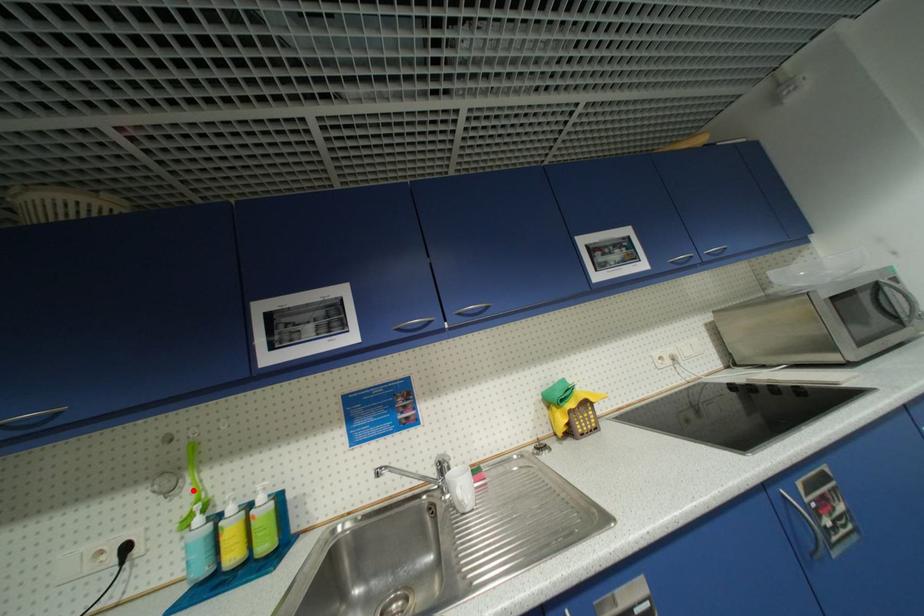
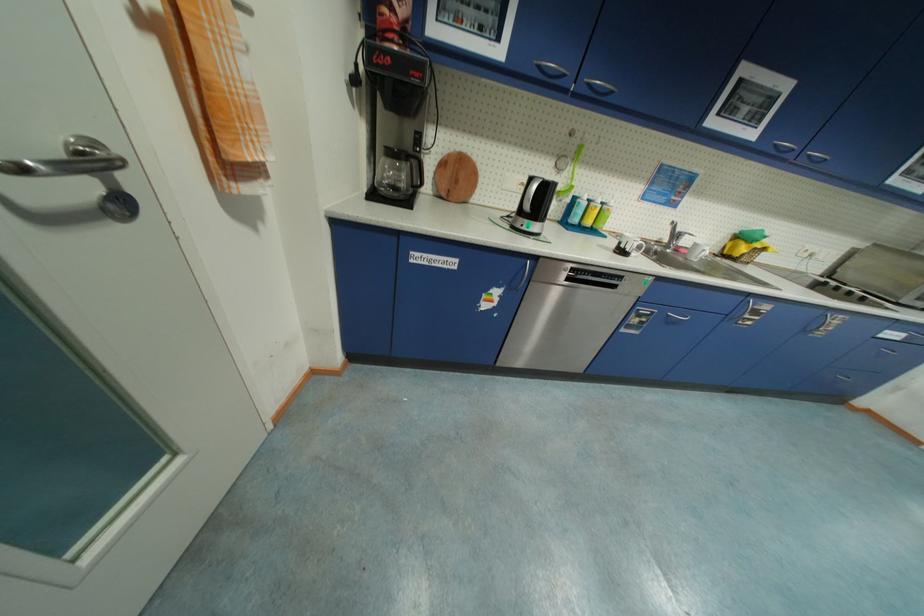
Find the pixel in the second image that matches the highlighted location in the first image.

(570, 175)